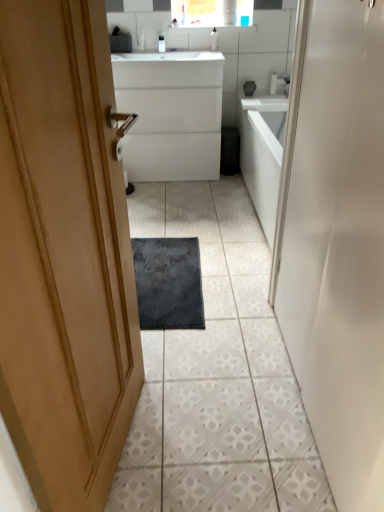
What do you see at coordinates (171, 114) in the screenshot?
I see `white glossy cabinet at center` at bounding box center [171, 114].

What do you see at coordinates (168, 283) in the screenshot?
I see `dark gray textured bath mat at center` at bounding box center [168, 283].

This screenshot has height=512, width=384. Describe the element at coordinates (336, 241) in the screenshot. I see `white glossy door at center` at that location.

What do you see at coordinates (214, 39) in the screenshot? The image size is (384, 512). I see `white glossy soap dispenser at upper center, placed as the 1th toiletry when sorted from right to left` at bounding box center [214, 39].

Find the location of `white glossy soap dispenser at upper center, which ranks as the 2th toiletry in right-to-left order`. white glossy soap dispenser at upper center, which ranks as the 2th toiletry in right-to-left order is located at coordinates (161, 42).

The image size is (384, 512). I want to click on white glossy cabinet at center, so click(x=171, y=114).

Considering the relative sizes of white textured tile at center and white glossy door at center in the image provided, is white textured tile at center thinner than white glossy door at center?

No.

Is white textured tile at center located outside white glossy door at center?

That's correct, white textured tile at center is outside of white glossy door at center.

In the scene shown: Which is closer, (212,183) or (316,415)?

The point (316,415) is more forward.

Can you confirm if white textured tile at center is shorter than white glossy door at center?

Correct, white textured tile at center is not as tall as white glossy door at center.

From a real-world perspective, is dark gray textured bath mat at center on top of white textured tile at center?

Indeed, from a real-world perspective, dark gray textured bath mat at center stands above white textured tile at center.

Between point (139, 293) and point (253, 376), which one is positioned behind?

The point (139, 293) is farther from the camera.

How far apart are dark gray textured bath mat at center and white textured tile at center?

They are 9.48 inches apart.

Can you tell me how much dark gray textured bath mat at center and white textured tile at center differ in facing direction?

0.878 degrees separate the facing orientations of dark gray textured bath mat at center and white textured tile at center.

Who is bigger, matte white faucet at upper center or dark gray textured bath mat at center?

Bigger between the two is dark gray textured bath mat at center.

Does matte white faucet at upper center have a greater width compared to dark gray textured bath mat at center?

No, matte white faucet at upper center is not wider than dark gray textured bath mat at center.

Is matte white faucet at upper center directly adjacent to dark gray textured bath mat at center?

No.

In the scene shown: Is matte white faucet at upper center facing away from dark gray textured bath mat at center?

matte white faucet at upper center is not turned away from dark gray textured bath mat at center.

In terms of height, does white glossy door at center look taller or shorter compared to dark gray textured bath mat at center?

Considering their sizes, white glossy door at center has more height than dark gray textured bath mat at center.

From the picture: Does white glossy door at center appear on the left side of dark gray textured bath mat at center?

Incorrect, white glossy door at center is not on the left side of dark gray textured bath mat at center.

Locate an element on the screen. The image size is (384, 512). door positioned vertically above the dark gray textured bath mat at center (from a real-world perspective) is located at coordinates (336, 241).

How many degrees apart are the facing directions of white glossy door at center and dark gray textured bath mat at center?

89.2 degrees.

From a real-world perspective, is white glossy soap dispenser at upper center, the 1th toiletry in the left-to-right sequence, located beneath white glossy door at center?

No.

Locate an element on the screen. The width and height of the screenshot is (384, 512). door that is under the white glossy soap dispenser at upper center, the 1th toiletry in the left-to-right sequence (from a real-world perspective) is located at coordinates (336, 241).

Is white glossy soap dispenser at upper center, which ranks as the 2th toiletry in right-to-left order, placed right next to white glossy door at center?

white glossy soap dispenser at upper center, which ranks as the 2th toiletry in right-to-left order, and white glossy door at center are clearly separated.

Looking at this image, which is farther from the camera, [361,368] or [176,23]?

The point [176,23] is farther from the camera.

From the image's perspective, is white glossy door at center on top of matte white faucet at upper center?

No.

Is white glossy door at center completely or partially outside of matte white faucet at upper center?

Indeed, white glossy door at center is completely outside matte white faucet at upper center.

Considering the relative positions of matte white faucet at upper center and white glossy door at center in the image provided, is matte white faucet at upper center to the left or to the right of white glossy door at center?

matte white faucet at upper center is positioned on white glossy door at center's left side.

How far apart are matte white faucet at upper center and white glossy door at center?

A distance of 2.42 meters exists between matte white faucet at upper center and white glossy door at center.

Can you confirm if matte white faucet at upper center is wider than white glossy door at center?

Incorrect, the width of matte white faucet at upper center does not surpass that of white glossy door at center.

From the image's perspective, between matte white faucet at upper center and white glossy door at center, who is located below?

white glossy door at center is shown below in the image.

Image resolution: width=384 pixels, height=512 pixels. What are the coordinates of `door above the white textured tile at center (from the image's perspective)` in the screenshot? It's located at (336, 241).

Identify the location of ceramic tile below the dark gray textured bath mat at center (from a real-world perspective). (217, 375).

Which object lies further to the anchor point white glossy soap dispenser at upper center, the 1th toiletry in the left-to-right sequence, white textured tile at center or white glossy cabinet at center?

Based on the image, white textured tile at center appears to be further to white glossy soap dispenser at upper center, the 1th toiletry in the left-to-right sequence.

Based on the photo, looking at the image, which one is located further to white textured tile at center, dark gray textured bath mat at center or matte white faucet at upper center?

Based on the image, matte white faucet at upper center appears to be further to white textured tile at center.

Considering their positions, is white glossy door at center positioned closer to white textured tile at center than white glossy soap dispenser at upper center, the 1th toiletry in the left-to-right sequence?

Among the two, white glossy door at center is located nearer to white textured tile at center.

When comparing their distances from white textured tile at center, does dark gray textured bath mat at center or white glossy door at center seem further?

white glossy door at center.

Considering their positions, is dark gray textured bath mat at center positioned closer to white glossy soap dispenser at upper center, the 1th toiletry in the left-to-right sequence, than white glossy door at center?

dark gray textured bath mat at center is positioned closer to the anchor white glossy soap dispenser at upper center, the 1th toiletry in the left-to-right sequence.

Which object lies further to the anchor point white glossy door at center, white glossy soap dispenser at upper center, placed as the 1th toiletry when sorted from right to left, or white textured tile at center?

white glossy soap dispenser at upper center, placed as the 1th toiletry when sorted from right to left, is positioned further to the anchor white glossy door at center.

Based on their spatial positions, is white glossy door at center or white textured tile at center closer to matte white faucet at upper center?

The object closer to matte white faucet at upper center is white textured tile at center.

From the image, which object appears to be nearer to white textured tile at center, white glossy soap dispenser at upper center, which ranks as the 2th toiletry in right-to-left order, or dark gray textured bath mat at center?

dark gray textured bath mat at center.

You are a GUI agent. You are given a task and a screenshot of the screen. Output one action in this format:
    pyautogui.click(x=<x>, y=<y>)
    Task: Click on the ceramic tile that lies between matte white faucet at upper center and dark gray textured bath mat at center from top to bottom
    This screenshot has width=384, height=512.
    Given the screenshot: What is the action you would take?
    pyautogui.click(x=217, y=375)

The height and width of the screenshot is (512, 384). Find the location of `faucet located between white glossy soap dispenser at upper center, which ranks as the 2th toiletry in right-to-left order, and white glossy soap dispenser at upper center, placed as the second toiletry when sorted from left to right, in the left-right direction`. faucet located between white glossy soap dispenser at upper center, which ranks as the 2th toiletry in right-to-left order, and white glossy soap dispenser at upper center, placed as the second toiletry when sorted from left to right, in the left-right direction is located at coordinates (174, 22).

Where is `bath mat between white glossy door at center and white glossy cabinet at center along the z-axis`? bath mat between white glossy door at center and white glossy cabinet at center along the z-axis is located at coordinates (168, 283).

Find the location of a particular element. bathroom cabinet between white glossy soap dispenser at upper center, placed as the second toiletry when sorted from left to right, and dark gray textured bath mat at center vertically is located at coordinates coord(171,114).